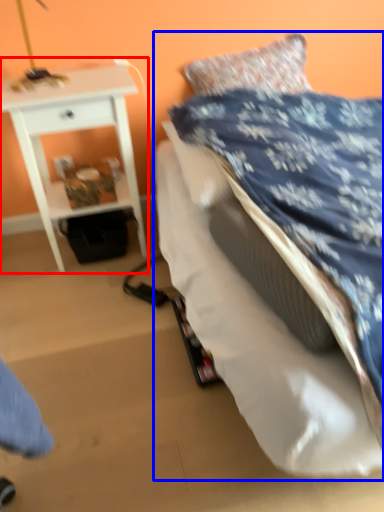
Question: Which object is closer to the camera taking this photo, nightstand (highlighted by a red box) or bed (highlighted by a blue box)?

Choices:
 (A) nightstand
 (B) bed

Answer: (B)